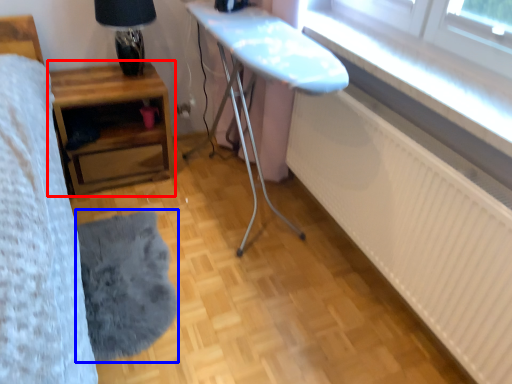
Question: Among these objects, which one is nearest to the camera, table (highlighted by a red box) or mat (highlighted by a blue box)?

Choices:
 (A) table
 (B) mat

Answer: (B)